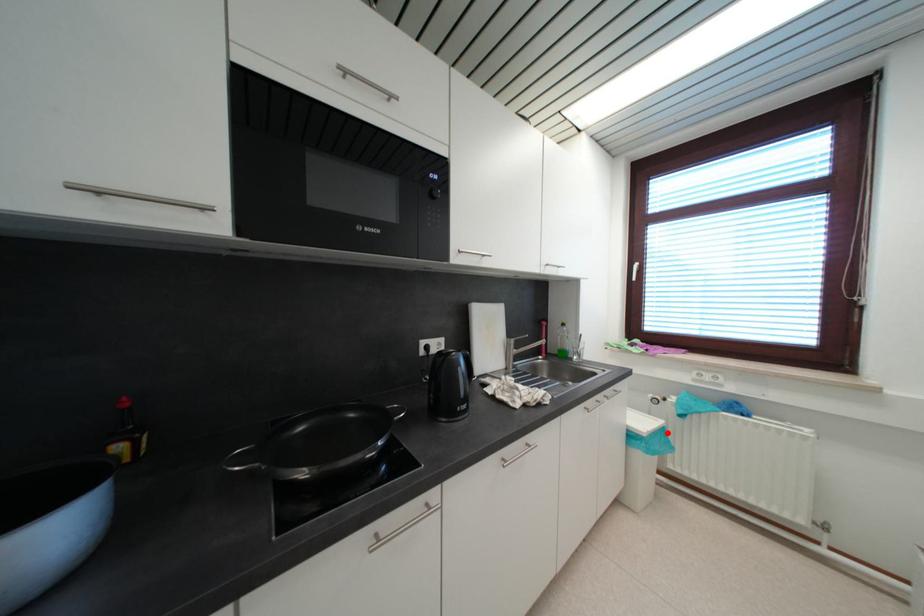
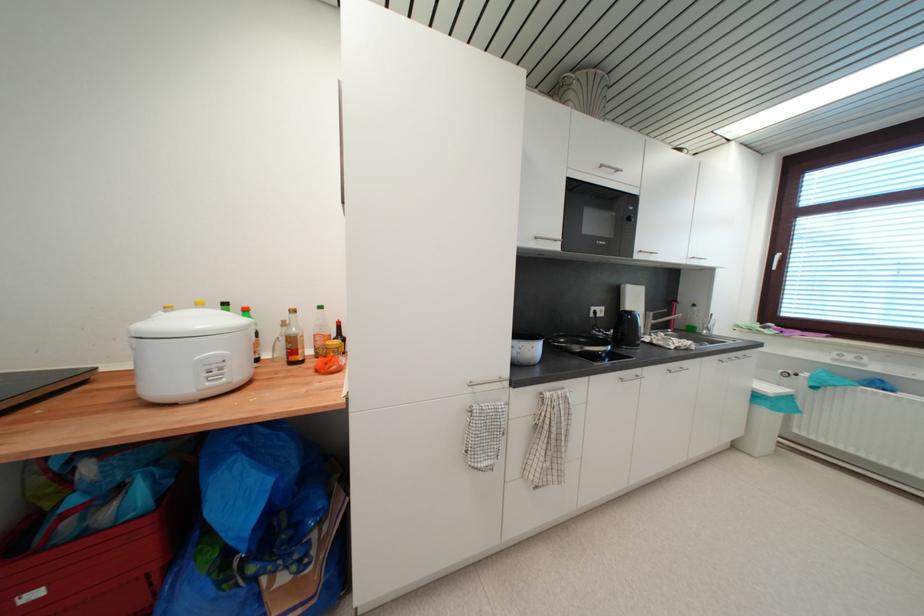
The point at the highlighted location is marked in the first image. Where is the corresponding point in the second image?

(795, 400)